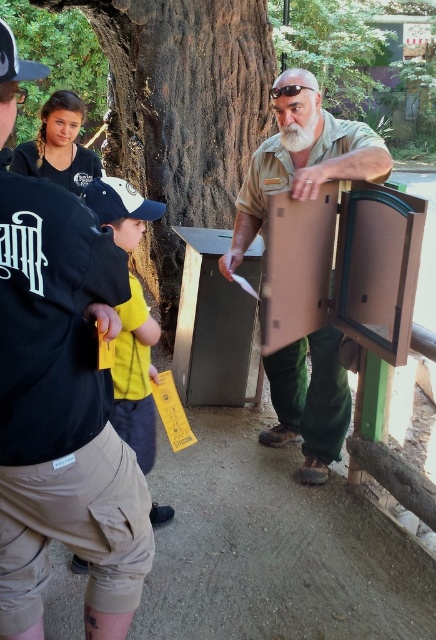
You are a traveler who just arrived at the park and needs to pack your belongings into a storage locker. You have a matte brown suitcase at center and a white matte baseball cap at left. Which item should you place first into the locker to maximize space efficiency?

The matte brown suitcase at center is larger than the white matte baseball cap at left, so you should place the matte brown suitcase at center first to maximize space efficiency.

You are a visitor in the park and want to take a photo of the brown cardboard box at center and the green textured tree at upper left. Which object should you frame first in your camera viewfinder to ensure both are in the shot?

The green textured tree at upper left should be framed first since the brown cardboard box at center is positioned to its right, so by starting with the tree, you can adjust the viewfinder to include both objects.